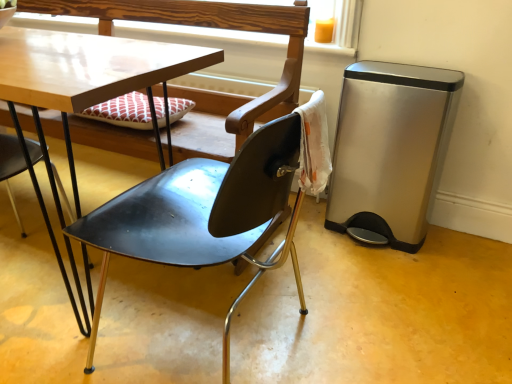
Where is `free location in front of satin silver trash can at right`? free location in front of satin silver trash can at right is located at coordinates (390, 271).